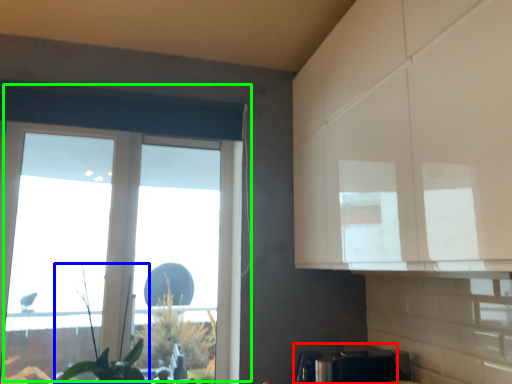
Question: Considering the real-world distances, which object is closest to appliance (highlighted by a red box)? plant (highlighted by a blue box) or window (highlighted by a green box).

Choices:
 (A) plant
 (B) window

Answer: (A)